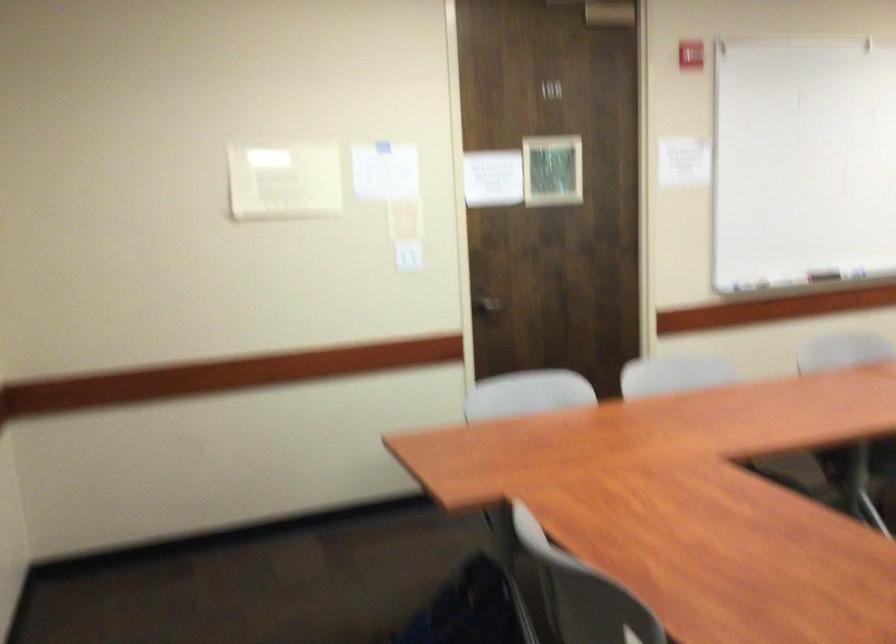
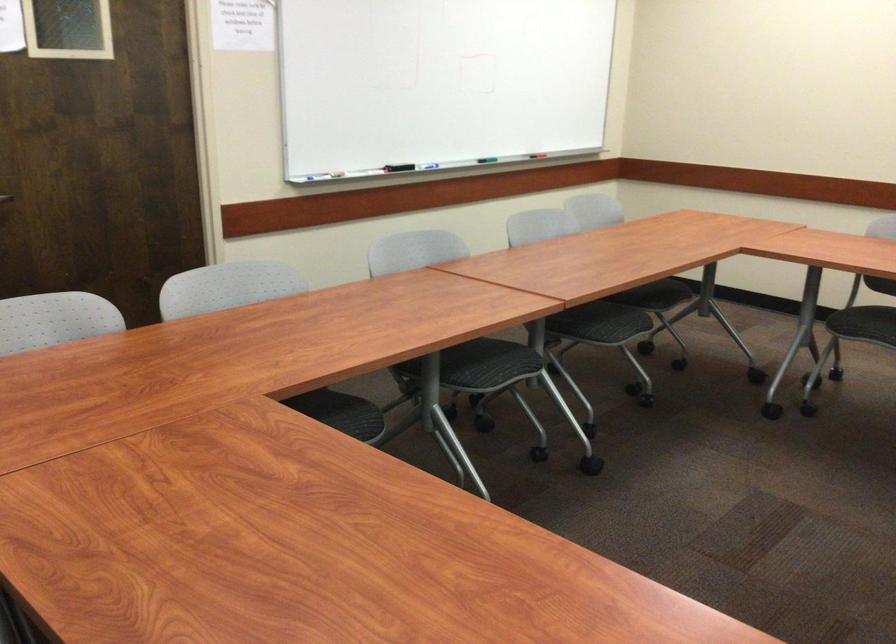
The point at (506, 301) is marked in the first image. Where is the corresponding point in the second image?

(5, 198)